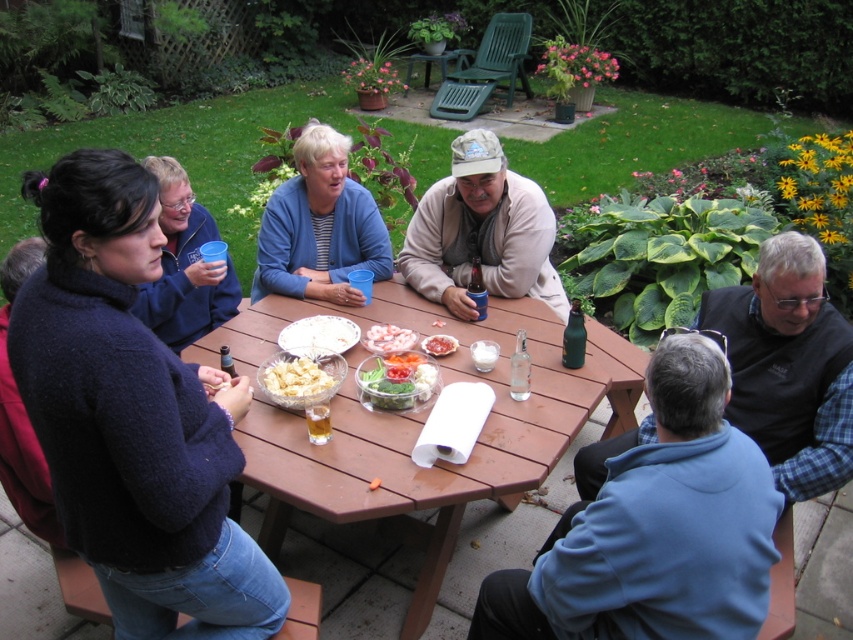
Measure the distance between white paper plate at center and sliced raw meat at center.

A distance of 13.23 inches exists between white paper plate at center and sliced raw meat at center.

Looking at this image, is white paper plate at center further to camera compared to sliced raw meat at center?

No, white paper plate at center is closer to the viewer.

Locate an element on the screen. white paper plate at center is located at coordinates (x=318, y=333).

Can you confirm if dark blue fleece at upper left is taller than white paper plate at center?

Indeed, dark blue fleece at upper left has a greater height compared to white paper plate at center.

Is dark blue fleece at upper left behind white paper plate at center?

No.

Does point (161, 410) come farther from viewer compared to point (311, 330)?

No, (161, 410) is in front of (311, 330).

Locate an element on the screen. dark blue fleece at upper left is located at coordinates (132, 417).

In the scene shown: Which is above, blue fleece jacket at center or white paper plate at center?

blue fleece jacket at center

Between point (337, 144) and point (351, 333), which one is positioned behind?

The point (337, 144) is more distant.

Find the location of `blue fleece jacket at center`. blue fleece jacket at center is located at coordinates (318, 227).

The width and height of the screenshot is (853, 640). In order to click on blue fleece jacket at center in this screenshot , I will do `click(318, 227)`.